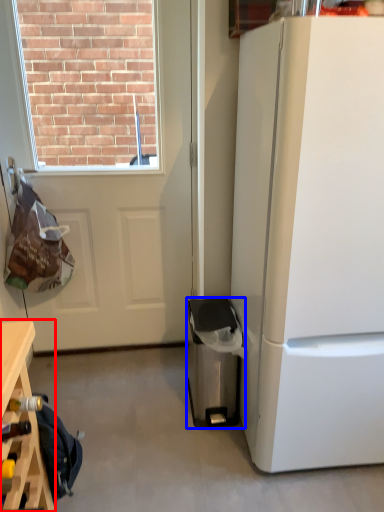
Question: Which object is closer to the camera taking this photo, table (highlighted by a red box) or trash bin/can (highlighted by a blue box)?

Choices:
 (A) table
 (B) trash bin/can

Answer: (A)